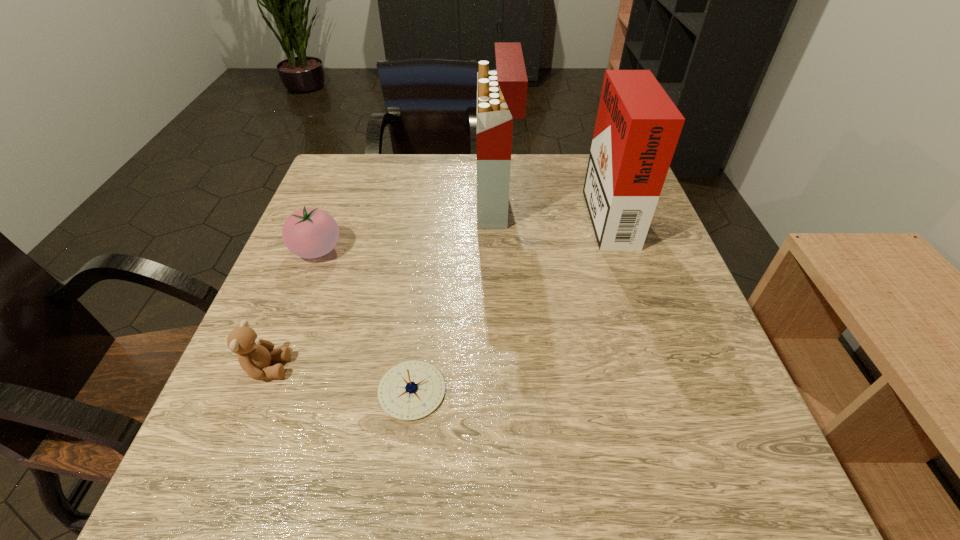
Image resolution: width=960 pixels, height=540 pixels. What are the coordinates of `free space located 0.380m on the front-facing side of the right cigarette case` in the screenshot? It's located at point(436,212).

Where is `free point located on the front-facing side of the right cigarette case`? free point located on the front-facing side of the right cigarette case is located at coordinates (456, 212).

Image resolution: width=960 pixels, height=540 pixels. In order to click on vacant region located on the right of the tomato in this screenshot , I will do `click(396, 250)`.

Identify the location of vacant region located on the front-facing side of the teddy bear. Image resolution: width=960 pixels, height=540 pixels. (482, 368).

The height and width of the screenshot is (540, 960). I want to click on vacant area located 0.090m on the back of the third object from left to right, so click(x=420, y=323).

Find the location of a particular element. tomato situated at the left edge is located at coordinates (309, 233).

What are the coordinates of `teddy bear located in the left edge section of the desktop` in the screenshot? It's located at click(x=254, y=354).

Identify the location of object that is at the right edge. click(637, 129).

Locate an element on the screen. This screenshot has width=960, height=540. object located at the far right corner is located at coordinates (637, 129).

The height and width of the screenshot is (540, 960). Identify the location of free location at the far edge of the desktop. (519, 199).